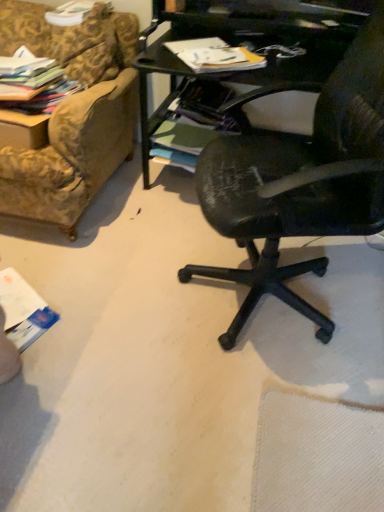
Question: Does multicolored fabric stack at upper left, the 2th magazine when ordered from right to left, appear on the right side of gold-patterned fabric couch at upper left?

Choices:
 (A) no
 (B) yes

Answer: (B)

Question: From a real-world perspective, is multicolored fabric stack at upper left, the 2th magazine when ordered from right to left, positioned under gold-patterned fabric couch at upper left based on gravity?

Choices:
 (A) no
 (B) yes

Answer: (B)

Question: Does multicolored fabric stack at upper left, the first magazine viewed from the left, appear on the left side of gold-patterned fabric couch at upper left?

Choices:
 (A) yes
 (B) no

Answer: (B)

Question: From the image's perspective, does multicolored fabric stack at upper left, the first magazine viewed from the left, appear higher than gold-patterned fabric couch at upper left?

Choices:
 (A) yes
 (B) no

Answer: (B)

Question: Is multicolored fabric stack at upper left, the first magazine viewed from the left, shorter than gold-patterned fabric couch at upper left?

Choices:
 (A) no
 (B) yes

Answer: (B)

Question: Does point (28, 55) appear closer or farther from the camera than point (102, 140)?

Choices:
 (A) closer
 (B) farther

Answer: (A)

Question: In terms of width, does multicolored fabric stack at upper left, the first magazine viewed from the left, look wider or thinner when compared to gold-patterned fabric couch at upper left?

Choices:
 (A) thin
 (B) wide

Answer: (B)

Question: From their relative heights in the image, would you say multicolored fabric stack at upper left, the 2th magazine when ordered from right to left, is taller or shorter than gold-patterned fabric couch at upper left?

Choices:
 (A) short
 (B) tall

Answer: (A)

Question: From a real-world perspective, is multicolored fabric stack at upper left, the first magazine viewed from the left, physically located above or below gold-patterned fabric couch at upper left?

Choices:
 (A) below
 (B) above

Answer: (A)

Question: Is multicolored fabric stack at upper left, the first magazine viewed from the left, in front of or behind matte paper magazine at upper center, the first magazine when ordered from right to left, in the image?

Choices:
 (A) behind
 (B) front

Answer: (A)

Question: In terms of size, does multicolored fabric stack at upper left, the 2th magazine when ordered from right to left, appear bigger or smaller than matte paper magazine at upper center, which ranks as the 2th magazine in left-to-right order?

Choices:
 (A) big
 (B) small

Answer: (A)

Question: Do you think multicolored fabric stack at upper left, the 2th magazine when ordered from right to left, is within matte paper magazine at upper center, the first magazine when ordered from right to left, or outside of it?

Choices:
 (A) outside
 (B) inside

Answer: (A)

Question: From the image's perspective, relative to matte paper magazine at upper center, the first magazine when ordered from right to left, is multicolored fabric stack at upper left, the first magazine viewed from the left, above or below?

Choices:
 (A) above
 (B) below

Answer: (B)

Question: Is point (81, 163) positioned closer to the camera than point (223, 53)?

Choices:
 (A) farther
 (B) closer

Answer: (A)

Question: Is gold-patterned fabric couch at upper left situated inside matte paper magazine at upper center, which ranks as the 2th magazine in left-to-right order, or outside?

Choices:
 (A) inside
 (B) outside

Answer: (B)